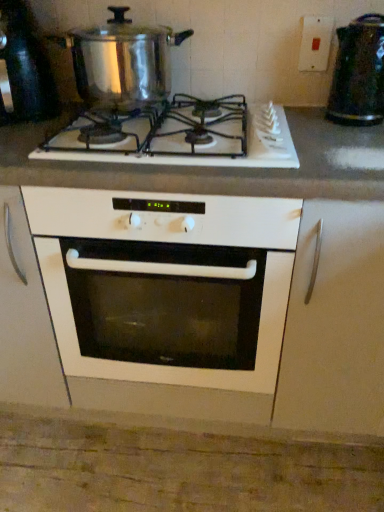
Question: Considering their positions, is shiny metallic pot at upper left located in front of or behind white glossy countertop at center?

Choices:
 (A) front
 (B) behind

Answer: (B)

Question: Is shiny metallic pot at upper left situated inside white glossy countertop at center or outside?

Choices:
 (A) outside
 (B) inside

Answer: (A)

Question: Based on their relative distances, which object is nearer to the shiny metallic pot at upper left?

Choices:
 (A) white glossy countertop at center
 (B) shiny metallic pot at upper left, positioned as the 1th appliance in left-to-right order
 (C) white glossy gas stove at center
 (D) metallic textured kettle at upper right, the first appliance viewed from the right
 (E) white matte cabinet door at right

Answer: (C)

Question: Estimate the real-world distances between objects in this image. Which object is closer to the white matte cabinet door at right?

Choices:
 (A) shiny metallic pot at upper left
 (B) shiny metallic pot at upper left, positioned as the 1th appliance in left-to-right order
 (C) metallic textured kettle at upper right, the first appliance viewed from the right
 (D) white plastic switch at upper right
 (E) white glossy gas stove at center

Answer: (E)